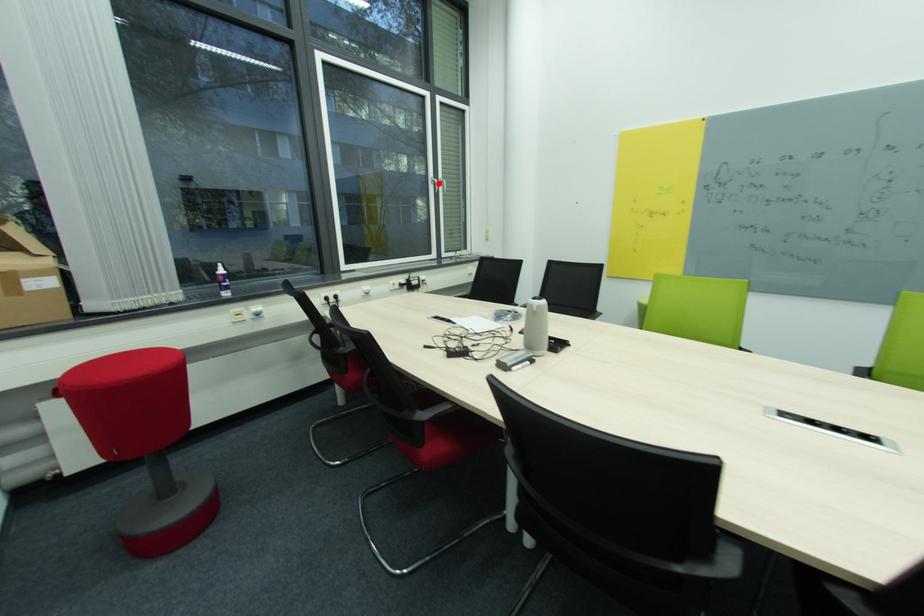
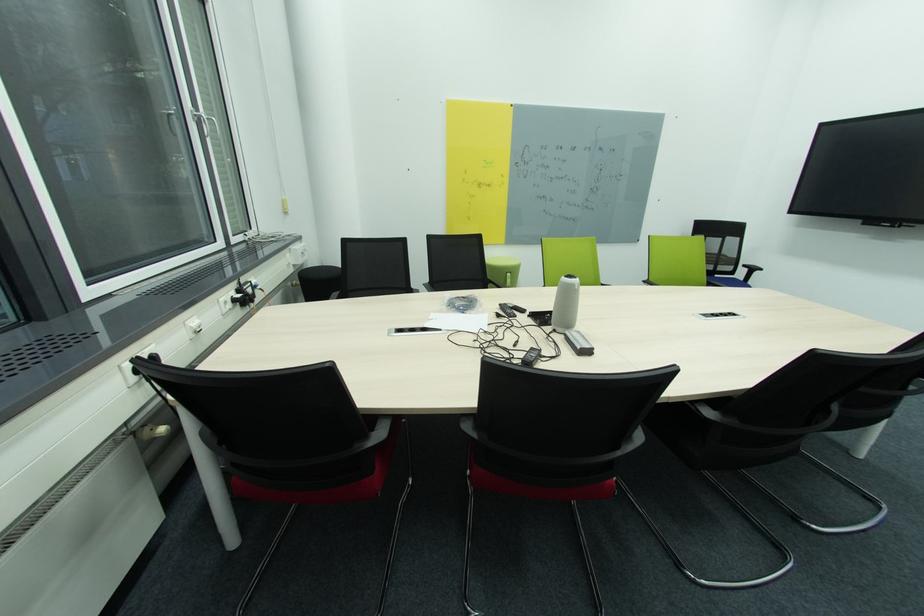
Question: A red point is marked in image1. In image2, is the corresponding 3D point closer to the camera or farther? Reply with the corresponding letter.

Choices:
 (A) The corresponding 3D point is closer.
 (B) The corresponding 3D point is farther.

Answer: (B)